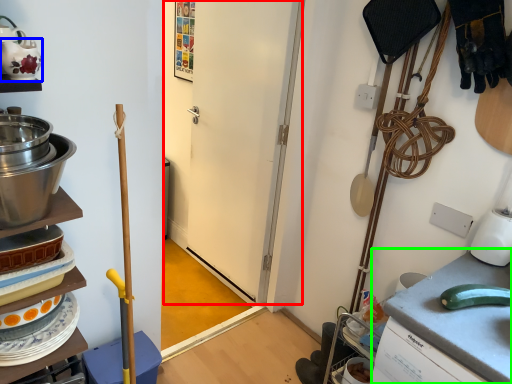
Question: Which is nearer to the door (highlighted by a red box)? tea pot (highlighted by a blue box) or counter top (highlighted by a green box).

Choices:
 (A) tea pot
 (B) counter top

Answer: (B)